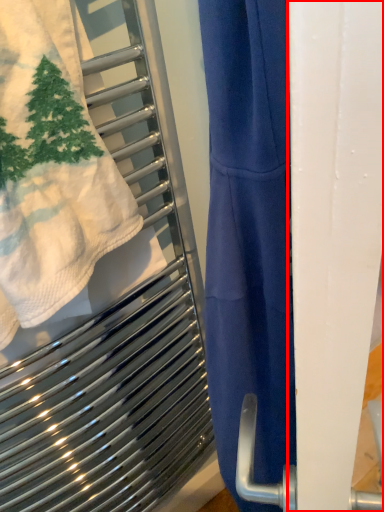
Question: Considering the relative positions of screen door (annotated by the red box) and towel in the image provided, where is screen door (annotated by the red box) located with respect to the staircase?

Choices:
 (A) left
 (B) right

Answer: (B)